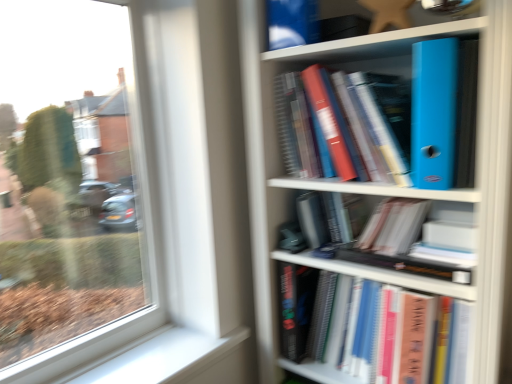
Locate an element on the screen. This screenshot has height=384, width=512. blue plastic folder at upper right, marked as the second book in a bottom-to-top arrangement is located at coordinates (426, 114).

In the scene shown: What is the approximate width of blue plastic folder at upper right, which is the first book from top to bottom?

11.79 inches.

Describe the element at coordinates (377, 332) in the screenshot. I see `hardcover book at center, which is the 1th book in bottom-to-top order` at that location.

The image size is (512, 384). Describe the element at coordinates (384, 199) in the screenshot. I see `matte plastic bookcase at right` at that location.

You are a GUI agent. You are given a task and a screenshot of the screen. Output one action in this format:
    pyautogui.click(x=<x>, y=<y>)
    Task: Click on the blue plastic folder at upper right, marked as the second book in a bottom-to-top arrangement
    This screenshot has width=512, height=384.
    Given the screenshot: What is the action you would take?
    coord(426,114)

Considering the sizes of blue plastic folder at upper right, marked as the second book in a bottom-to-top arrangement, and matte plastic bookcase at right in the image, is blue plastic folder at upper right, marked as the second book in a bottom-to-top arrangement, taller or shorter than matte plastic bookcase at right?

Considering their sizes, blue plastic folder at upper right, marked as the second book in a bottom-to-top arrangement, has less height than matte plastic bookcase at right.

Which is nearer, [369,127] or [281,81]?

Point [369,127] is closer to the camera than point [281,81].

Which object is positioned more to the right, blue plastic folder at upper right, which is the first book from top to bottom, or matte plastic bookcase at right?

Positioned to the right is matte plastic bookcase at right.

Is blue plastic folder at upper right, which is the first book from top to bottom, aimed at matte plastic bookcase at right?

Yes, blue plastic folder at upper right, which is the first book from top to bottom, is facing matte plastic bookcase at right.

Based on the photo, which is closer, (454, 334) or (329, 265)?

Point (454, 334)

Is hardcover book at center, which is the second book from top to bottom, placed right next to matte plastic bookcase at right?

There is a gap between hardcover book at center, which is the second book from top to bottom, and matte plastic bookcase at right.

From the image's perspective, between hardcover book at center, which is the second book from top to bottom, and matte plastic bookcase at right, which one is located above?

matte plastic bookcase at right, from the image's perspective.

How much distance is there between hardcover book at center, which is the second book from top to bottom, and matte plastic bookcase at right?

They are 6.82 inches apart.

In terms of height, does blue plastic folder at upper right, marked as the second book in a bottom-to-top arrangement, look taller or shorter compared to hardcover book at center, which is the second book from top to bottom?

blue plastic folder at upper right, marked as the second book in a bottom-to-top arrangement, is shorter than hardcover book at center, which is the second book from top to bottom.

Is blue plastic folder at upper right, which is the first book from top to bottom, closer to camera compared to hardcover book at center, which is the 1th book in bottom-to-top order?

That is True.

Is blue plastic folder at upper right, which is the first book from top to bottom, not within hardcover book at center, which is the second book from top to bottom?

blue plastic folder at upper right, which is the first book from top to bottom, lies outside hardcover book at center, which is the second book from top to bottom,'s area.

From a real-world perspective, which is physically below, blue plastic folder at upper right, which is the first book from top to bottom, or hardcover book at center, which is the second book from top to bottom?

hardcover book at center, which is the second book from top to bottom.

Looking at this image, is white smooth window sill at lower left a part of blue plastic folder at upper right, which is the first book from top to bottom?

Definitely not — white smooth window sill at lower left is not inside blue plastic folder at upper right, which is the first book from top to bottom.

From the image's perspective, does blue plastic folder at upper right, which is the first book from top to bottom, appear lower than white smooth window sill at lower left?

No, from the image's perspective, blue plastic folder at upper right, which is the first book from top to bottom, is not beneath white smooth window sill at lower left.

The width and height of the screenshot is (512, 384). I want to click on the 2nd book positioned above the white smooth window sill at lower left (from the image's perspective), so click(x=426, y=114).

From the picture: Who is bigger, blue plastic folder at upper right, marked as the second book in a bottom-to-top arrangement, or white smooth window sill at lower left?

blue plastic folder at upper right, marked as the second book in a bottom-to-top arrangement, is bigger.

Between matte plastic bookcase at right and white smooth window sill at lower left, which one has less height?

white smooth window sill at lower left is shorter.

Is matte plastic bookcase at right smaller than white smooth window sill at lower left?

Incorrect, matte plastic bookcase at right is not smaller in size than white smooth window sill at lower left.

In the image, is matte plastic bookcase at right positioned in front of or behind white smooth window sill at lower left?

matte plastic bookcase at right is in front of white smooth window sill at lower left.

Locate an element on the screen. The width and height of the screenshot is (512, 384). bookcase on the right of white smooth window sill at lower left is located at coordinates (384, 199).

Which of these two, hardcover book at center, which is the 1th book in bottom-to-top order, or white smooth window sill at lower left, is bigger?

hardcover book at center, which is the 1th book in bottom-to-top order, is bigger.

Is white smooth window sill at lower left at the back of hardcover book at center, which is the second book from top to bottom?

No, hardcover book at center, which is the second book from top to bottom,'s orientation is not away from white smooth window sill at lower left.

Based on the photo, how much distance is there between hardcover book at center, which is the 1th book in bottom-to-top order, and white smooth window sill at lower left?

hardcover book at center, which is the 1th book in bottom-to-top order, and white smooth window sill at lower left are 15.67 inches apart.

Is hardcover book at center, which is the 1th book in bottom-to-top order, to the left of white smooth window sill at lower left from the viewer's perspective?

Incorrect, hardcover book at center, which is the 1th book in bottom-to-top order, is not on the left side of white smooth window sill at lower left.

How many degrees apart are the facing directions of white smooth window sill at lower left and hardcover book at center, which is the second book from top to bottom?

The angular difference between white smooth window sill at lower left and hardcover book at center, which is the second book from top to bottom, is 89.6 degrees.

Between white smooth window sill at lower left and hardcover book at center, which is the second book from top to bottom, which one has larger size?

hardcover book at center, which is the second book from top to bottom, is bigger.

From the image's perspective, is white smooth window sill at lower left located beneath hardcover book at center, which is the 1th book in bottom-to-top order?

Yes.

From a real-world perspective, is white smooth window sill at lower left over hardcover book at center, which is the second book from top to bottom?

Actually, white smooth window sill at lower left is physically below hardcover book at center, which is the second book from top to bottom, in the real world.

At what (x,y) coordinates should I click in order to perform the action: click on bookcase below the blue plastic folder at upper right, marked as the second book in a bottom-to-top arrangement (from the image's perspective). Please return your answer as a coordinate pair (x, y). Looking at the image, I should click on (384, 199).

I want to click on bookcase above the hardcover book at center, which is the 1th book in bottom-to-top order (from the image's perspective), so (x=384, y=199).

Considering their positions, is white smooth window sill at lower left positioned closer to matte plastic bookcase at right than blue plastic folder at upper right, marked as the second book in a bottom-to-top arrangement?

blue plastic folder at upper right, marked as the second book in a bottom-to-top arrangement, lies closer to matte plastic bookcase at right than the other object.

Which object lies nearer to the anchor point hardcover book at center, which is the second book from top to bottom, white smooth window sill at lower left or blue plastic folder at upper right, marked as the second book in a bottom-to-top arrangement?

Among the two, white smooth window sill at lower left is located nearer to hardcover book at center, which is the second book from top to bottom.

When comparing their distances from matte plastic bookcase at right, does hardcover book at center, which is the second book from top to bottom, or white smooth window sill at lower left seem closer?

hardcover book at center, which is the second book from top to bottom.

When comparing their distances from white smooth window sill at lower left, does blue plastic folder at upper right, marked as the second book in a bottom-to-top arrangement, or hardcover book at center, which is the second book from top to bottom, seem further?

Among the two, blue plastic folder at upper right, marked as the second book in a bottom-to-top arrangement, is located further to white smooth window sill at lower left.

Based on the photo, when comparing their distances from hardcover book at center, which is the second book from top to bottom, does matte plastic bookcase at right or blue plastic folder at upper right, which is the first book from top to bottom, seem further?

blue plastic folder at upper right, which is the first book from top to bottom, lies further to hardcover book at center, which is the second book from top to bottom, than the other object.

Based on their spatial positions, is blue plastic folder at upper right, marked as the second book in a bottom-to-top arrangement, or matte plastic bookcase at right further from hardcover book at center, which is the 1th book in bottom-to-top order?

blue plastic folder at upper right, marked as the second book in a bottom-to-top arrangement, lies further to hardcover book at center, which is the 1th book in bottom-to-top order, than the other object.

Which object lies nearer to the anchor point blue plastic folder at upper right, which is the first book from top to bottom, hardcover book at center, which is the 1th book in bottom-to-top order, or matte plastic bookcase at right?

Based on the image, matte plastic bookcase at right appears to be nearer to blue plastic folder at upper right, which is the first book from top to bottom.

From the image, which object appears to be nearer to blue plastic folder at upper right, which is the first book from top to bottom, matte plastic bookcase at right or white smooth window sill at lower left?

matte plastic bookcase at right is closer to blue plastic folder at upper right, which is the first book from top to bottom.

Find the location of a particular element. The height and width of the screenshot is (384, 512). bookcase situated between white smooth window sill at lower left and hardcover book at center, which is the 1th book in bottom-to-top order, from left to right is located at coordinates (384, 199).

Identify the location of bookcase that lies between blue plastic folder at upper right, marked as the second book in a bottom-to-top arrangement, and hardcover book at center, which is the 1th book in bottom-to-top order, from top to bottom. The image size is (512, 384). (384, 199).

You are a GUI agent. You are given a task and a screenshot of the screen. Output one action in this format:
    pyautogui.click(x=<x>, y=<y>)
    Task: Click on the bookcase between blue plastic folder at upper right, which is the first book from top to bottom, and white smooth window sill at lower left vertically
    
    Given the screenshot: What is the action you would take?
    pyautogui.click(x=384, y=199)

Find the location of a particular element. book between blue plastic folder at upper right, marked as the second book in a bottom-to-top arrangement, and white smooth window sill at lower left in the up-down direction is located at coordinates (377, 332).